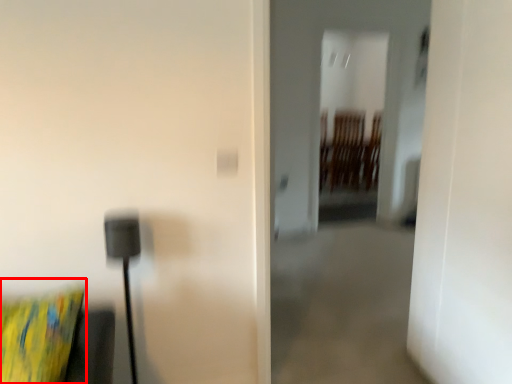
Question: From the image's perspective, what is the correct spatial relationship of pillow (annotated by the red box) in relation to glass door?

Choices:
 (A) above
 (B) below

Answer: (B)